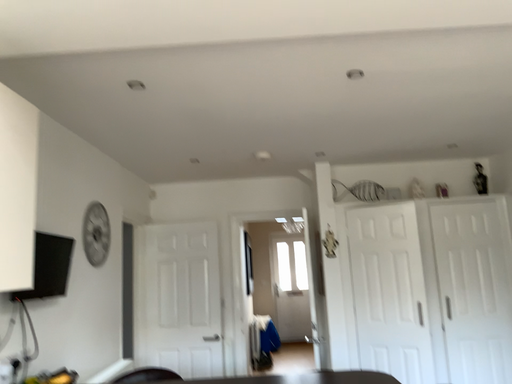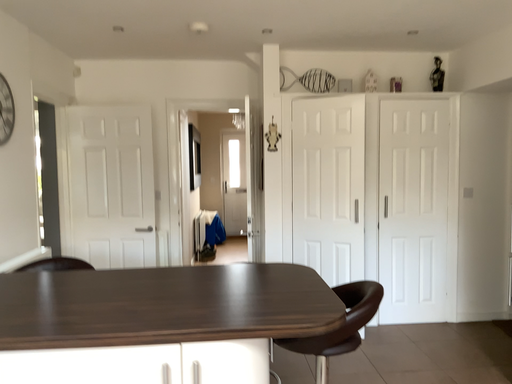
Question: Which way did the camera rotate in the video?

Choices:
 (A) rotated downward
 (B) rotated upward

Answer: (A)